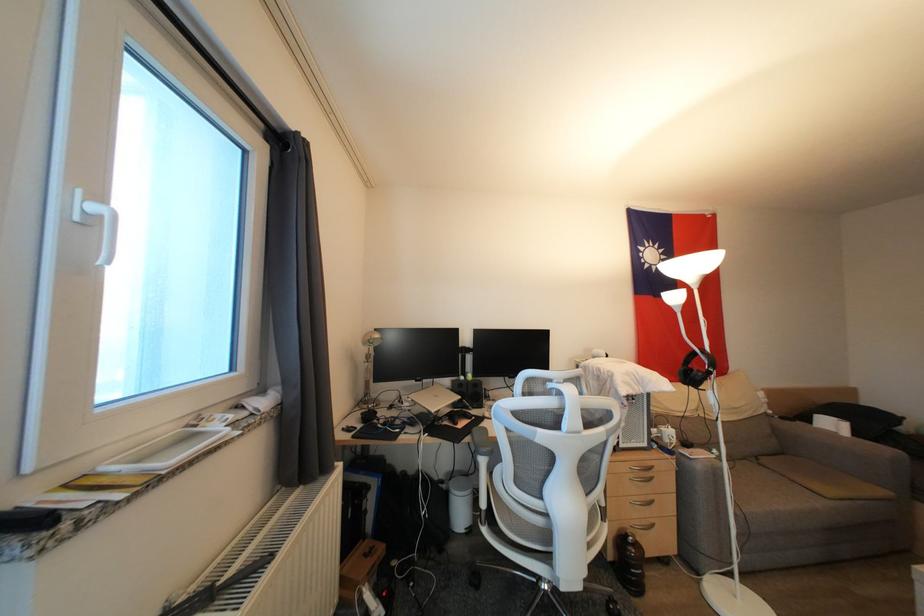
Where would you turn the white window handle? Please return your answer as a coordinate pair (x, y).

(103, 229)